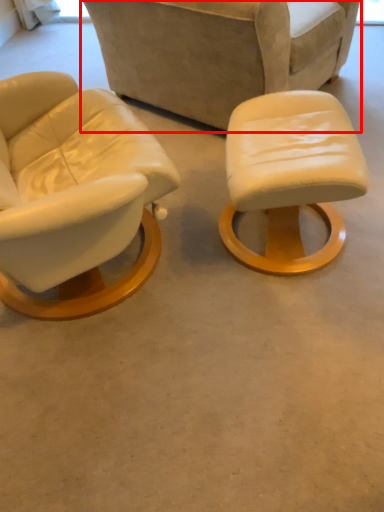
Question: Considering the relative positions of chair (annotated by the red box) and stool in the image provided, where is chair (annotated by the red box) located with respect to the staircase?

Choices:
 (A) right
 (B) left

Answer: (B)